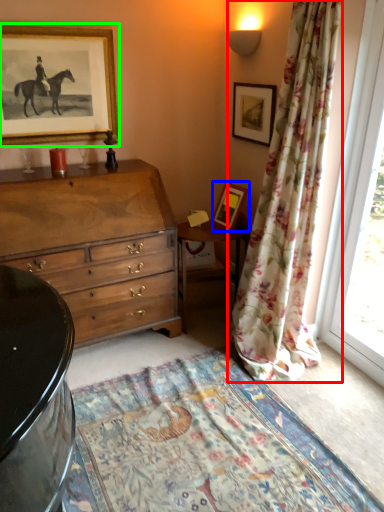
Question: Considering the real-world distances, which object is closest to curtain (highlighted by a red box)? picture frame (highlighted by a blue box) or picture frame (highlighted by a green box).

Choices:
 (A) picture frame
 (B) picture frame

Answer: (A)